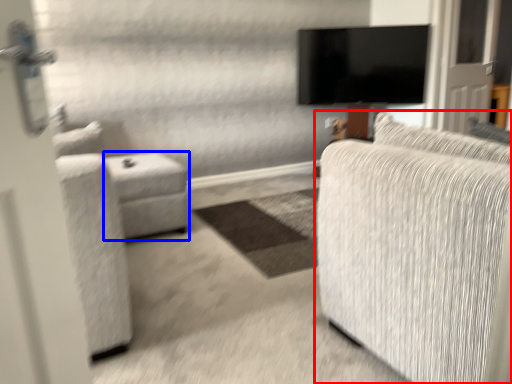
Question: Which object appears closest to the camera in this image, studio couch (highlighted by a red box) or table (highlighted by a blue box)?

Choices:
 (A) studio couch
 (B) table

Answer: (A)